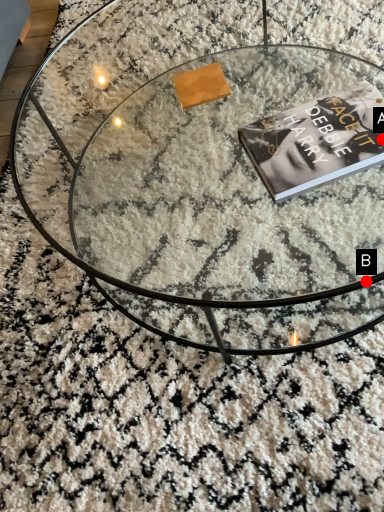
Question: Two points are circled on the image, labeled by A and B beside each circle. Which point is closer to the camera?

Choices:
 (A) A is closer
 (B) B is closer

Answer: (B)